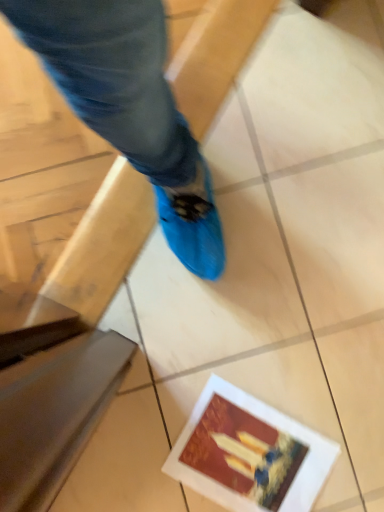
Image resolution: width=384 pixels, height=512 pixels. Find the location of `vacant area that lies to the right of smooth beige tile at lower left`. vacant area that lies to the right of smooth beige tile at lower left is located at coordinates (172, 453).